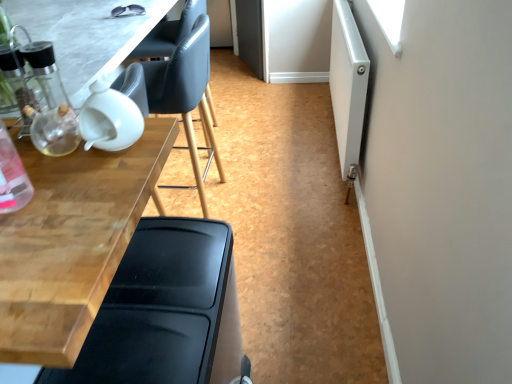
Question: Is black plastic chair at lower left, the second chair viewed from the back, bigger or smaller than white matte screen door at right?

Choices:
 (A) small
 (B) big

Answer: (B)

Question: In the image, is black plastic chair at lower left, marked as the first chair in a front-to-back arrangement, positioned in front of or behind white matte screen door at right?

Choices:
 (A) behind
 (B) front

Answer: (B)

Question: Which of these objects is positioned farthest from the white matte screen door at right?

Choices:
 (A) transparent glass table at upper left, the second table positioned from the bottom
 (B) wooden table at left, the 1th table in the bottom-to-top sequence
 (C) black plastic chair at lower left, marked as the first chair in a front-to-back arrangement
 (D) matte black chair at upper left, the first chair when ordered from top to bottom

Answer: (C)

Question: Which object is positioned farthest from the black plastic chair at lower left, which is the 1th chair from bottom to top?

Choices:
 (A) matte black chair at upper left, which appears as the 2th chair when viewed from the front
 (B) white matte screen door at right
 (C) wooden table at left, which is the 2th table from top to bottom
 (D) transparent glass table at upper left, placed as the first table when sorted from top to bottom

Answer: (B)